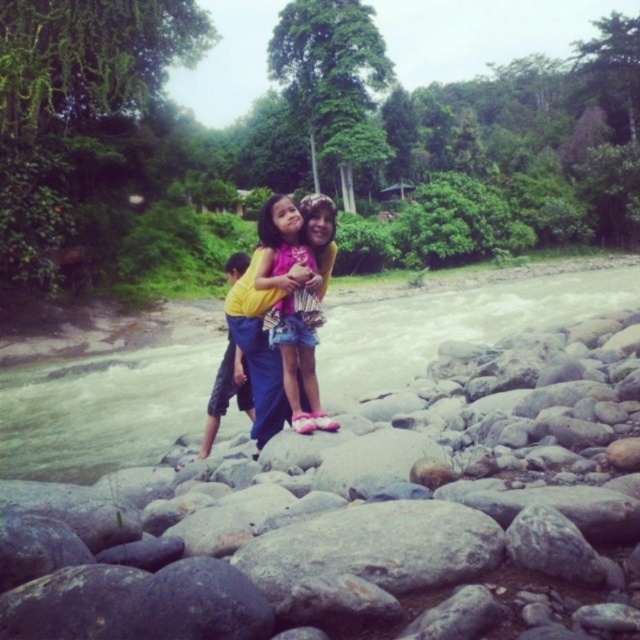
Between point (310, 316) and point (221, 362), which one is positioned in front?

Point (310, 316)

You are a GUI agent. You are given a task and a screenshot of the screen. Output one action in this format:
    pyautogui.click(x=<x>, y=<y>)
    Task: Click on the pink fabric dress at center
    The height and width of the screenshot is (640, 640).
    Given the screenshot: What is the action you would take?
    pyautogui.click(x=292, y=307)

What are the coordinates of `pink fabric dress at center` in the screenshot? It's located at 292,307.

This screenshot has width=640, height=640. What do you see at coordinates (392, 512) in the screenshot?
I see `smooth gray rock at center` at bounding box center [392, 512].

Looking at this image, who is positioned more to the left, smooth gray rock at center or pink fabric dress at center?

pink fabric dress at center is more to the left.

Is point (486, 595) farther from viewer compared to point (268, 285)?

No, (486, 595) is closer to viewer.

Where is `smooth gray rock at center`? The height and width of the screenshot is (640, 640). smooth gray rock at center is located at coordinates (392, 512).

Is smooth gray rock at center below clear water at stream center?

Correct, smooth gray rock at center is located below clear water at stream center.

Locate an element on the screen. The width and height of the screenshot is (640, 640). smooth gray rock at center is located at coordinates (392, 512).

In order to click on smooth gray rock at center in this screenshot , I will do `click(392, 512)`.